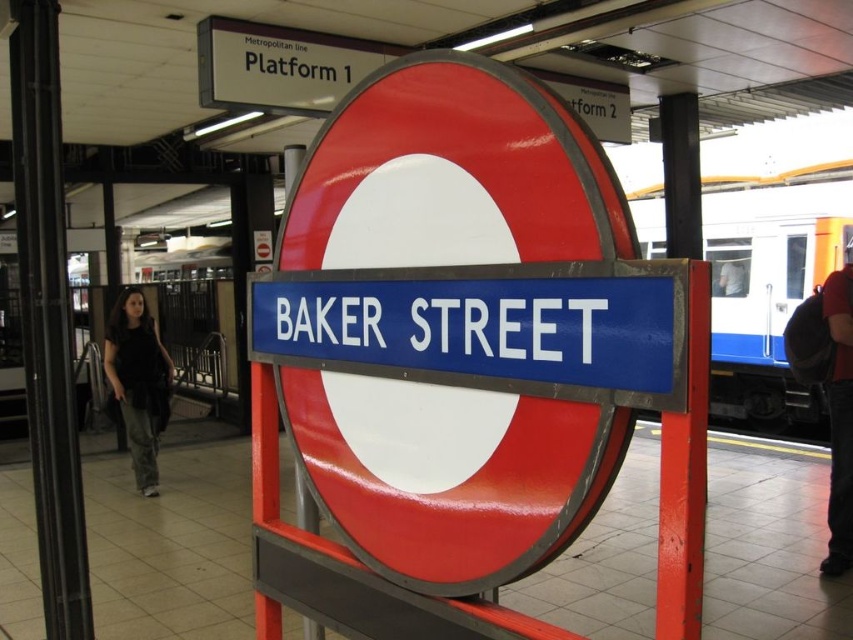
Is metallic red circle at center positioned before dark gray pants at left?

Yes.

Does metallic red circle at center appear under dark gray pants at left?

Actually, metallic red circle at center is above dark gray pants at left.

Which is behind, point (512, 576) or point (160, 346)?

The point (160, 346) is more distant.

The image size is (853, 640). Identify the location of metallic red circle at center. (451, 176).

Does red fabric shirt at right have a larger size compared to dark hair at center?

Indeed, red fabric shirt at right has a larger size compared to dark hair at center.

Is point (840, 464) behind point (718, 259)?

No, it is in front of (718, 259).

Who is more distant from viewer, (840,440) or (727,284)?

Point (727,284)

Find the location of a particular element. The image size is (853, 640). red fabric shirt at right is located at coordinates (839, 417).

Is metallic red circle at center further to camera compared to blue metallic train at right?

No.

Between point (332, 198) and point (664, 244), which one is positioned behind?

Positioned behind is point (664, 244).

Locate an element on the screen. The image size is (853, 640). metallic red circle at center is located at coordinates (451, 176).